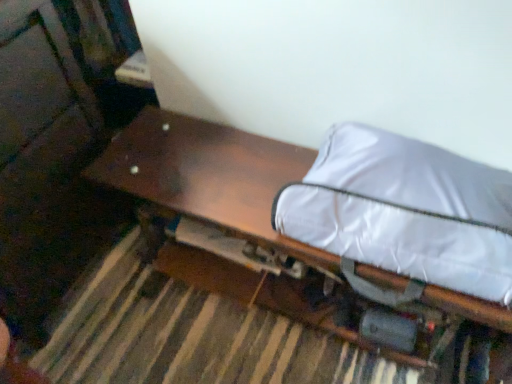
This screenshot has width=512, height=384. Identify the location of vacant space situated above wooden bench at center (from a real-world perspective). (228, 181).